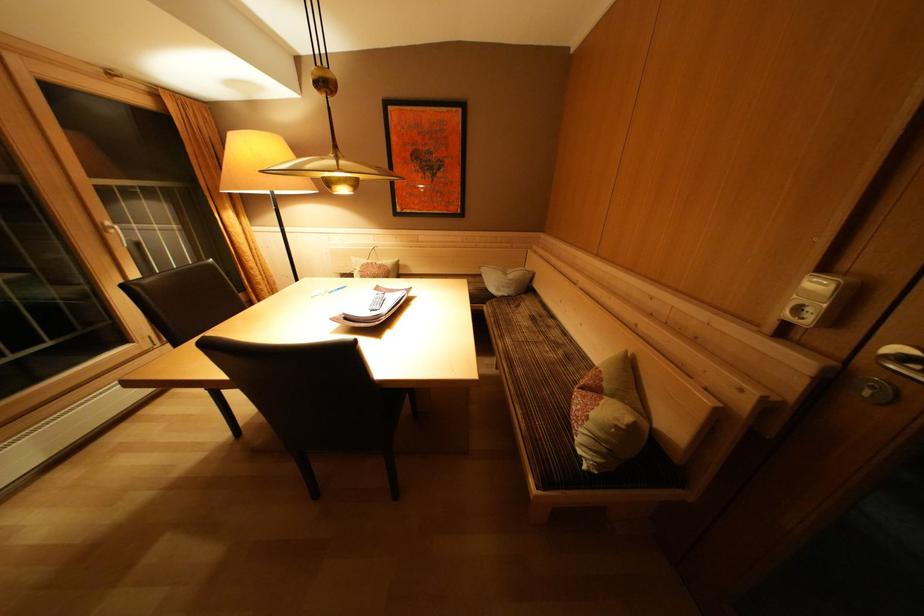
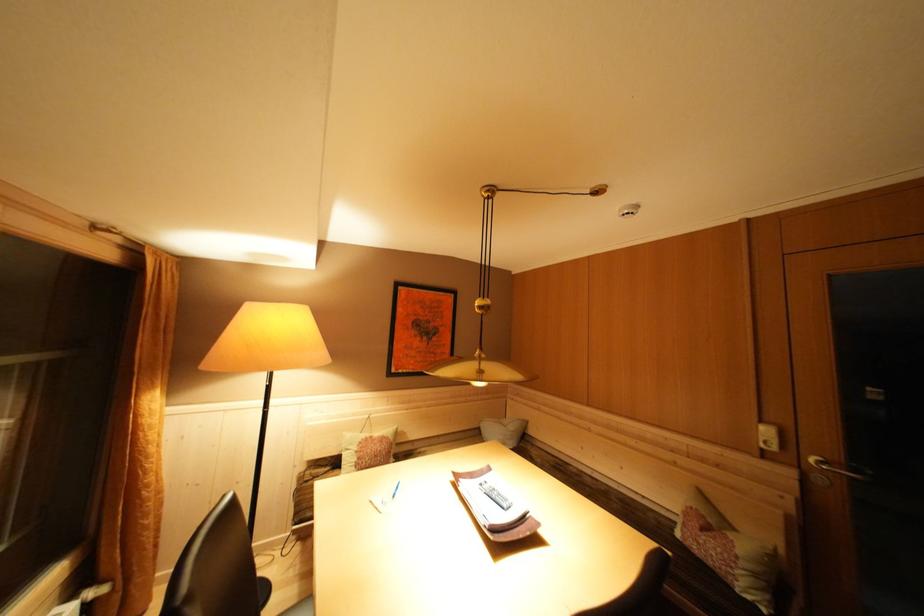
In the second image, find the point that corresponds to point (831, 275) in the first image.

(768, 427)